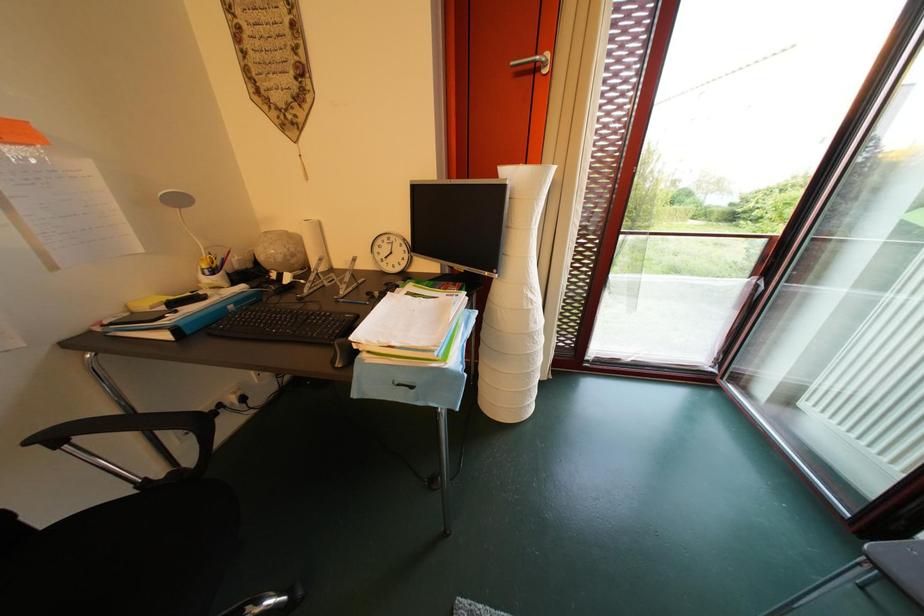
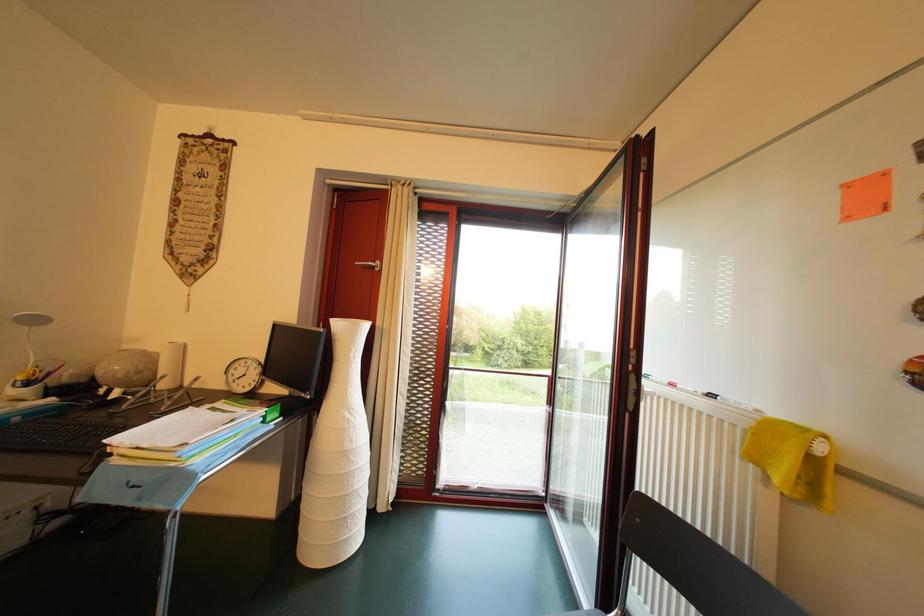
Question: The first image is from the beginning of the video and the second image is from the end. How did the camera likely rotate when shooting the video?

Choices:
 (A) Left
 (B) Right
 (C) Up
 (D) Down

Answer: (C)